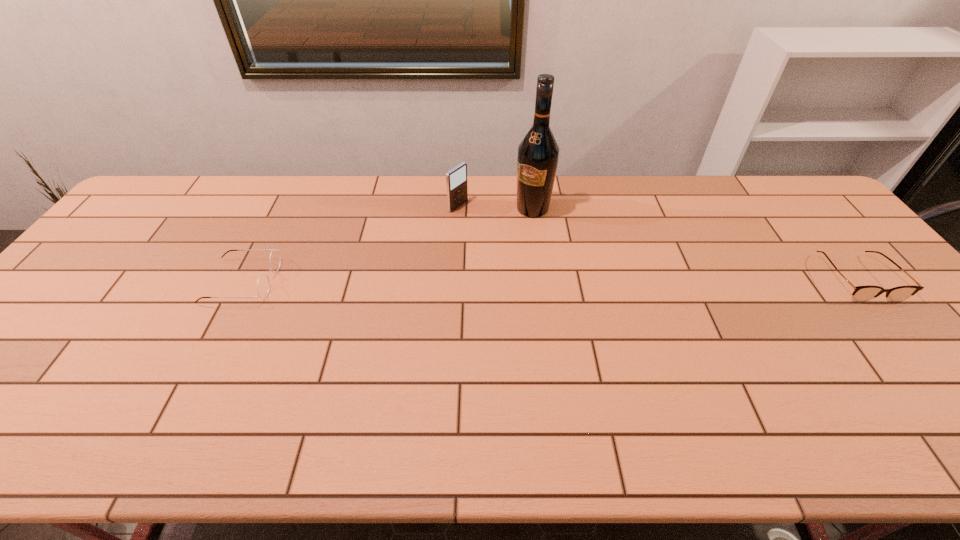
Where is `vacant space on the desktop that is between the leftmost object and the right spectacles and is positioned on the label of the tallest object`? The height and width of the screenshot is (540, 960). vacant space on the desktop that is between the leftmost object and the right spectacles and is positioned on the label of the tallest object is located at coordinates (475, 280).

You are a GUI agent. You are given a task and a screenshot of the screen. Output one action in this format:
    pyautogui.click(x=<x>, y=<y>)
    Task: Click on the free space on the desktop that is between the left spectacles and the right spectacles and is positioned on the front-facing side of the second tallest object
    
    Given the screenshot: What is the action you would take?
    pyautogui.click(x=601, y=279)